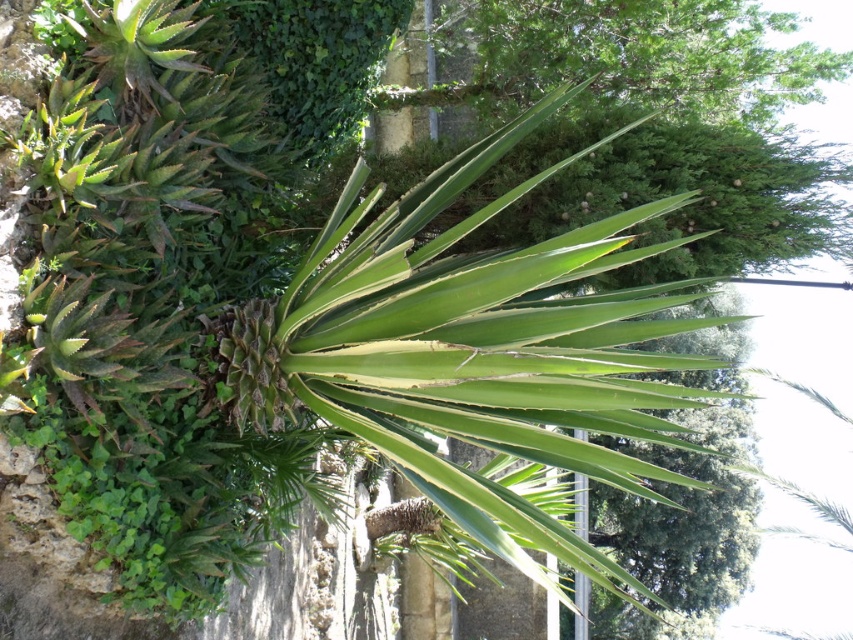
Question: Among these points, which one is farthest from the camera?

Choices:
 (A) (393, 365)
 (B) (717, 72)

Answer: (B)

Question: Does green leafy palm tree at center have a smaller size compared to green leafy plant at center?

Choices:
 (A) yes
 (B) no

Answer: (A)

Question: Which object appears farthest from the camera in this image?

Choices:
 (A) green leafy plant at center
 (B) green leafy palm tree at center

Answer: (A)

Question: Is green leafy palm tree at center smaller than green leafy plant at center?

Choices:
 (A) no
 (B) yes

Answer: (B)

Question: Does green leafy palm tree at center have a smaller size compared to green leafy plant at center?

Choices:
 (A) yes
 (B) no

Answer: (A)